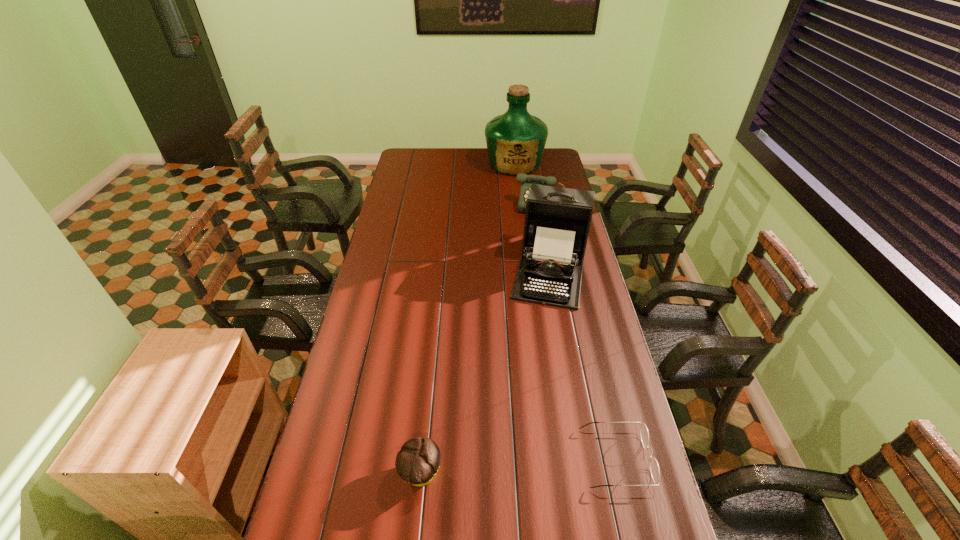
Where is `muffin present at the near edge`? muffin present at the near edge is located at coordinates (417, 462).

At what (x,y) coordinates should I click in order to perform the action: click on spectacles that is at the near edge. Please return your answer as a coordinate pair (x, y). Looking at the image, I should click on (653, 464).

I want to click on spectacles at the right edge, so click(x=653, y=464).

The image size is (960, 540). Find the location of `typewriter situated at the right edge`. typewriter situated at the right edge is located at coordinates (557, 220).

Find the location of a particular element. This screenshot has width=960, height=540. telephone that is at the right edge is located at coordinates (526, 180).

You are a GUI agent. You are given a task and a screenshot of the screen. Output one action in this format:
    pyautogui.click(x=<x>, y=<y>)
    Task: Click on the liquor that is at the right edge
    The width and height of the screenshot is (960, 540).
    Given the screenshot: What is the action you would take?
    [x=515, y=140]

Image resolution: width=960 pixels, height=540 pixels. I want to click on object at the far right corner, so click(515, 140).

I want to click on object that is at the near right corner, so click(x=653, y=464).

Image resolution: width=960 pixels, height=540 pixels. I want to click on free space at the near edge of the desktop, so tap(384, 488).

The height and width of the screenshot is (540, 960). In order to click on vacant space at the left edge of the desktop in this screenshot , I will do `click(351, 389)`.